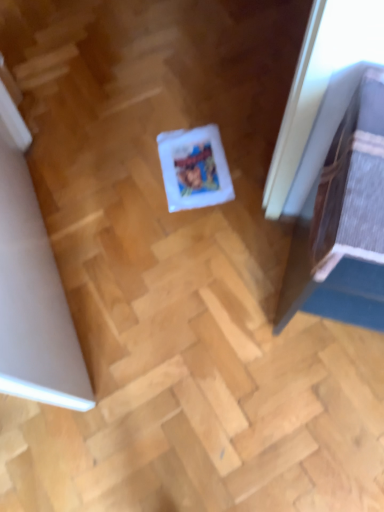
What are the coordinates of `blank space to the left of wooden door at right` in the screenshot? It's located at (221, 293).